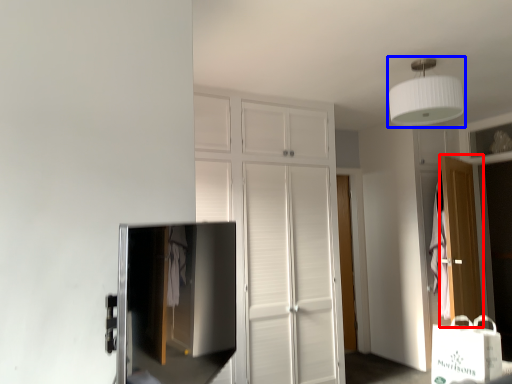
Question: Which point is further to the camera, door (highlighted by a red box) or lamp (highlighted by a blue box)?

Choices:
 (A) door
 (B) lamp

Answer: (A)